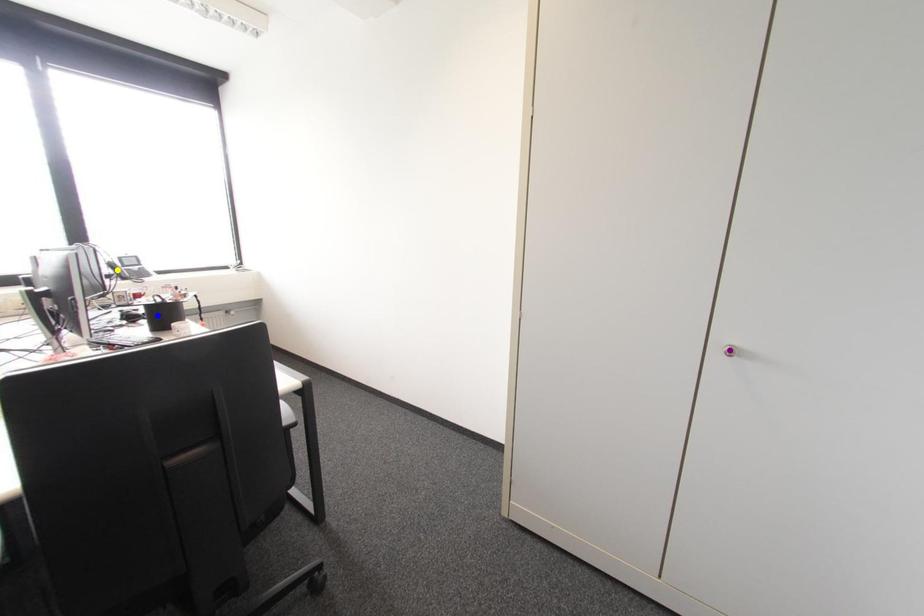
Order these from farthest to nearest:
A) yellow point
B) purple point
C) blue point

1. yellow point
2. blue point
3. purple point